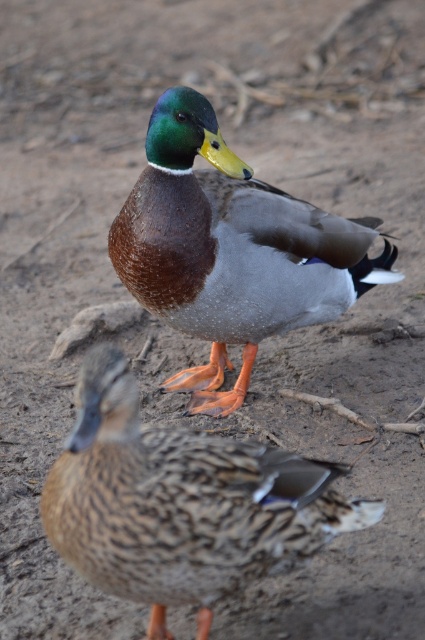
You are a photographer trying to capture both the brown speckled duck at lower left and the shiny brown duck at center in a single frame. Based on their positions, which duck should you focus on first to ensure both are in the shot?

The brown speckled duck at lower left is positioned on the left side of the shiny brown duck at center, so you should focus on the brown speckled duck at lower left first to ensure both are in the shot.

You are a birdwatcher observing two ducks in a muddy area. You notice a brown speckled duck at lower left and a shiny brown duck at center. Which duck is positioned lower in the image?

The brown speckled duck at lower left is positioned lower in the image because it is below the shiny brown duck at center.

Looking at this image, you are standing at the origin point of the image coordinate system. You see two points, point [155,584] and point [354,294]. Which point is closer to you?

Point [155,584] is in front of point [354,294], so it is closer to you.